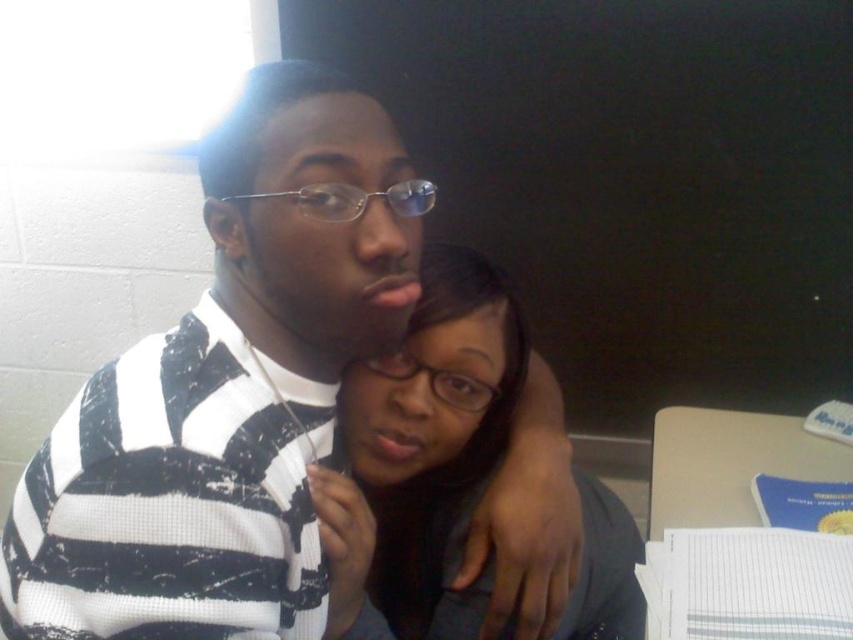
Is striped knit sweater at center smaller than matte black hair at center?

No.

Between point (323, 353) and point (352, 419), which one is positioned behind?

Point (352, 419)

Is point (206, 176) in front of point (471, 499)?

Yes, it is in front of point (471, 499).

Where is `striped knit sweater at center`? The height and width of the screenshot is (640, 853). striped knit sweater at center is located at coordinates (227, 388).